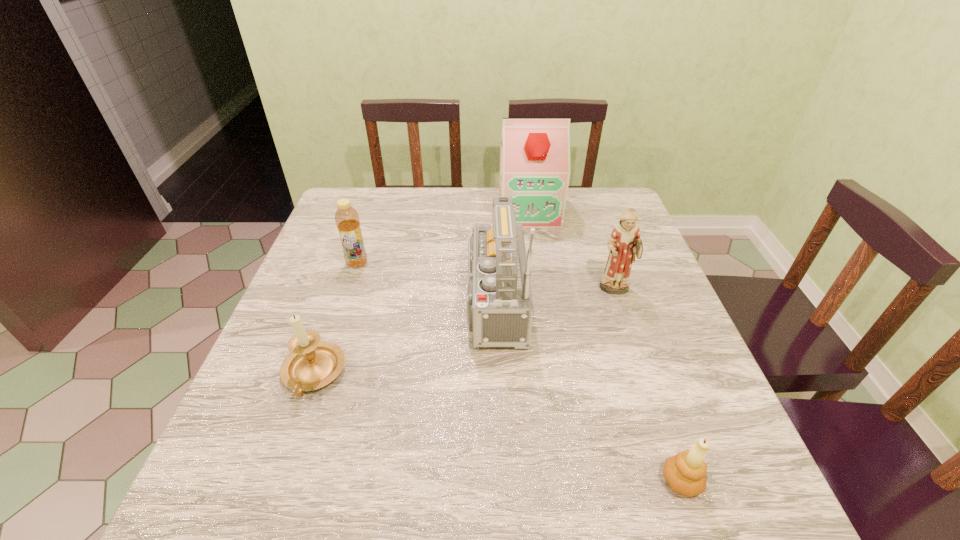
Image resolution: width=960 pixels, height=540 pixels. Find the location of `free space between the farthest object and the second shortest object`. free space between the farthest object and the second shortest object is located at coordinates (421, 293).

What are the coordinates of `vacant space that's between the soya milk and the fourth tallest object` in the screenshot? It's located at (444, 237).

Locate an element on the screen. This screenshot has width=960, height=540. free point between the farthest object and the bottle is located at coordinates (444, 237).

At what (x,y) coordinates should I click in order to perform the action: click on vacant space in between the radio receiver and the fourth shortest object. Please return your answer as a coordinate pair (x, y). Looking at the image, I should click on (550, 298).

Identify the location of empty space between the soya milk and the shorter candle_holder. (605, 346).

Identify the location of free area in between the second shortest object and the radio receiver. The height and width of the screenshot is (540, 960). (399, 339).

What are the coordinates of `object identified as the third closest to the taller candle_holder` in the screenshot? It's located at (535, 152).

Point out which object is positioned as the second nearest to the third tallest object. Please provide its 2D coordinates. Your answer should be formatted as a tuple, i.e. [(x, y)], where the tuple contains the x and y coordinates of a point satisfying the conditions above.

[(535, 152)]

Where is `vacant space that satisfies the following two spatial constraints: 1. on the front-facing side of the radio receiver; 2. on the left side of the shorter candle_holder`? vacant space that satisfies the following two spatial constraints: 1. on the front-facing side of the radio receiver; 2. on the left side of the shorter candle_holder is located at coordinates (489, 481).

What are the coordinates of `free space in the image that satisfies the following two spatial constraints: 1. on the front-facing side of the radio receiver; 2. with a handle on the side of the left candle_holder` in the screenshot? It's located at (487, 374).